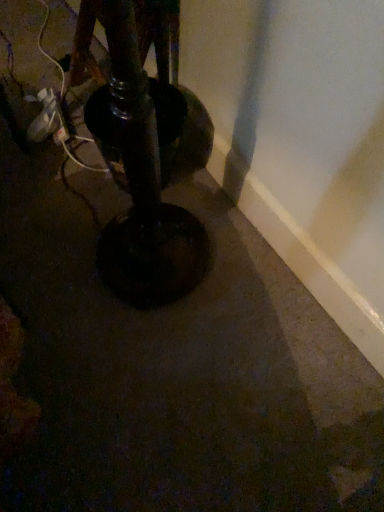
Measure the distance between black plastic wire at lower left and camera.

black plastic wire at lower left is 4.62 feet from camera.

At what (x,y) coordinates should I click in order to perform the action: click on black plastic wire at lower left. Please return your answer as a coordinate pair (x, y). The height and width of the screenshot is (512, 384). Looking at the image, I should click on (62, 101).

In order to face black plastic wire at lower left, should I rotate leftwards or rightwards?

You should rotate left by 18.376 degrees.

The image size is (384, 512). Describe the element at coordinates (62, 101) in the screenshot. I see `black plastic wire at lower left` at that location.

At what (x,y) coordinates should I click in order to perform the action: click on black plastic wire at lower left. Please return your answer as a coordinate pair (x, y). The width and height of the screenshot is (384, 512). Looking at the image, I should click on (62, 101).